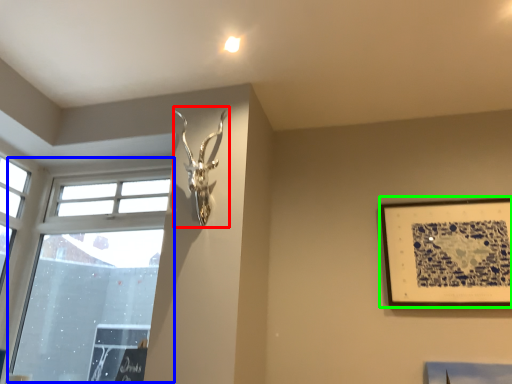
Question: Which object is positioned closest to sculpture (highlighted by a red box)? Select from window (highlighted by a blue box) and picture frame (highlighted by a green box).

Choices:
 (A) window
 (B) picture frame

Answer: (A)